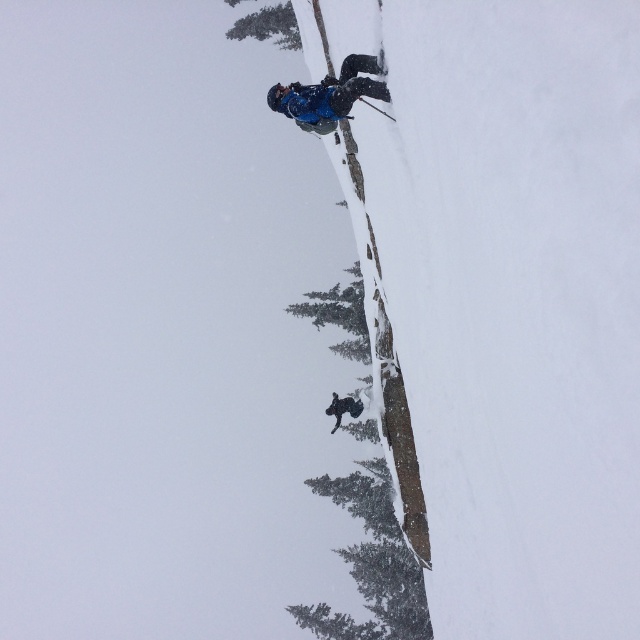
Question: Which point is closer to the camera?

Choices:
 (A) (275, 36)
 (B) (355, 93)
 (C) (336, 419)
 (D) (336, 424)

Answer: (B)

Question: Estimate the real-world distances between objects in this image. Which object is farther from the matte blue jacket at center?

Choices:
 (A) green textured pine tree at upper center
 (B) blue matte jacket at upper center
 (C) matte black ski at center

Answer: (A)

Question: Does blue matte jacket at upper center have a larger size compared to matte blue jacket at center?

Choices:
 (A) no
 (B) yes

Answer: (B)

Question: Which object appears farthest from the camera in this image?

Choices:
 (A) blue matte jacket at upper center
 (B) matte blue jacket at center
 (C) green textured pine tree at upper center
 (D) matte black ski at center

Answer: (C)

Question: Does blue matte jacket at upper center have a smaller size compared to matte black ski at center?

Choices:
 (A) yes
 (B) no

Answer: (B)

Question: Is green textured pine tree at upper center above matte black ski at center?

Choices:
 (A) no
 (B) yes

Answer: (B)